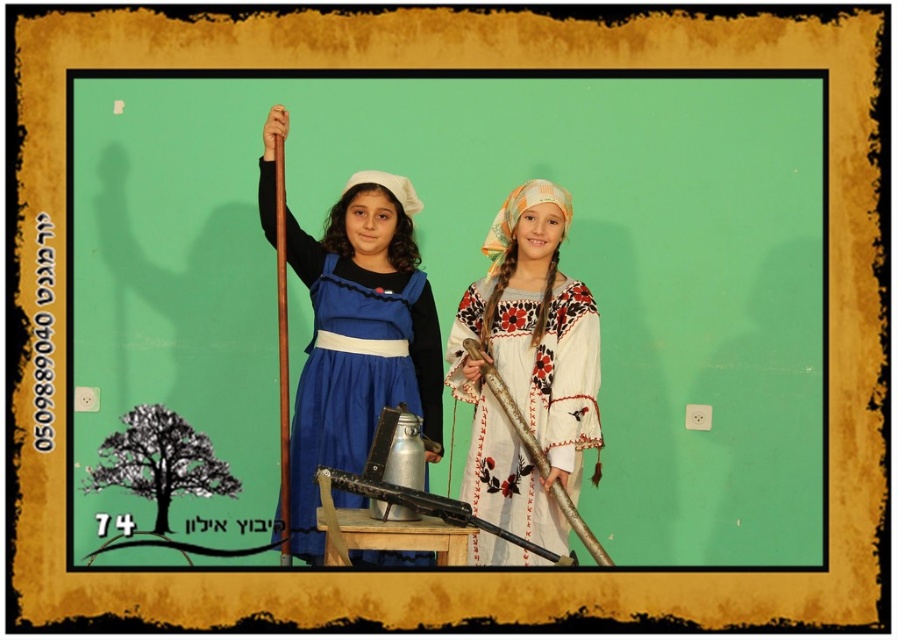
From the picture: You are an interior designer planning to place a large painting on the wall. Given the green matte wall at center and the matte blue dress at center, which object is more suitable for hanging the painting due to its size?

The green matte wall at center is bigger than the matte blue dress at center, so it is more suitable for hanging the large painting due to its larger size.

You are an interior designer assessing the space in the image. The green matte wall at center and the white embroidered dress at center are both in your view. Which object is taller?

The green matte wall at center is taller than the white embroidered dress at center according to the description.

You are standing at the point marked as point (398, 288). If you want to move closer to the camera, which direction should you move?

Since the distance of point (398, 288) from the camera is 4.67 meters, moving towards the camera would require moving in the direction opposite to the camera, but since the point is already at that distance, you would need to move towards the camera to reduce the distance. However, without additional spatial context, it is unclear the exact direction. The answer might be to move forward towards the camera.